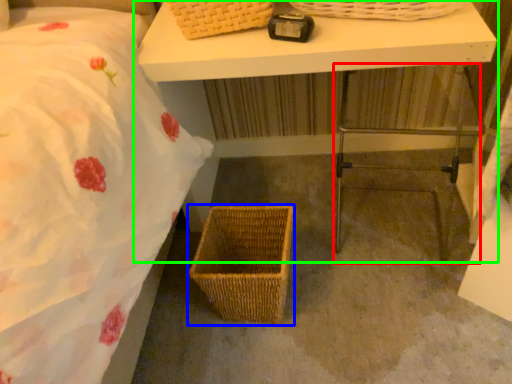
Question: Which object is positioned farthest from step stool (highlighted by a red box)? Select from picnic basket (highlighted by a blue box) and table (highlighted by a green box).

Choices:
 (A) picnic basket
 (B) table

Answer: (A)